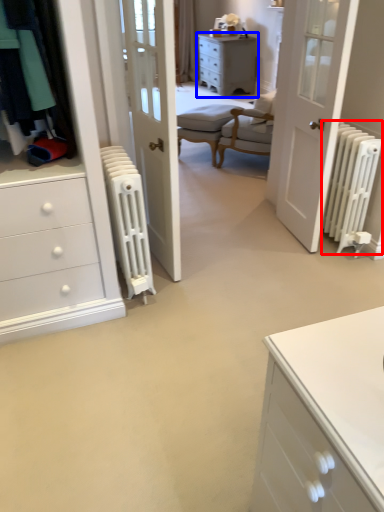
Question: Which point is closer to the camera, radiator (highlighted by a red box) or chest of drawers (highlighted by a blue box)?

Choices:
 (A) radiator
 (B) chest of drawers

Answer: (A)